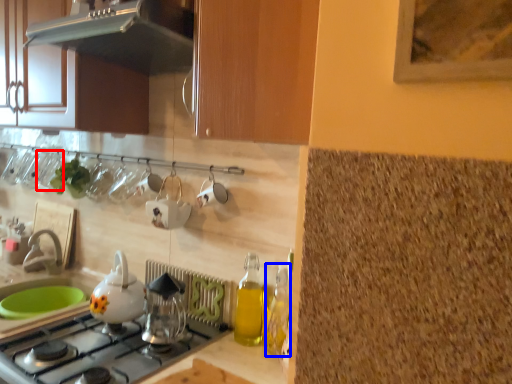
Question: Among these objects, which one is nearest to the camera, tableware (highlighted by a red box) or bottle (highlighted by a blue box)?

Choices:
 (A) tableware
 (B) bottle

Answer: (B)